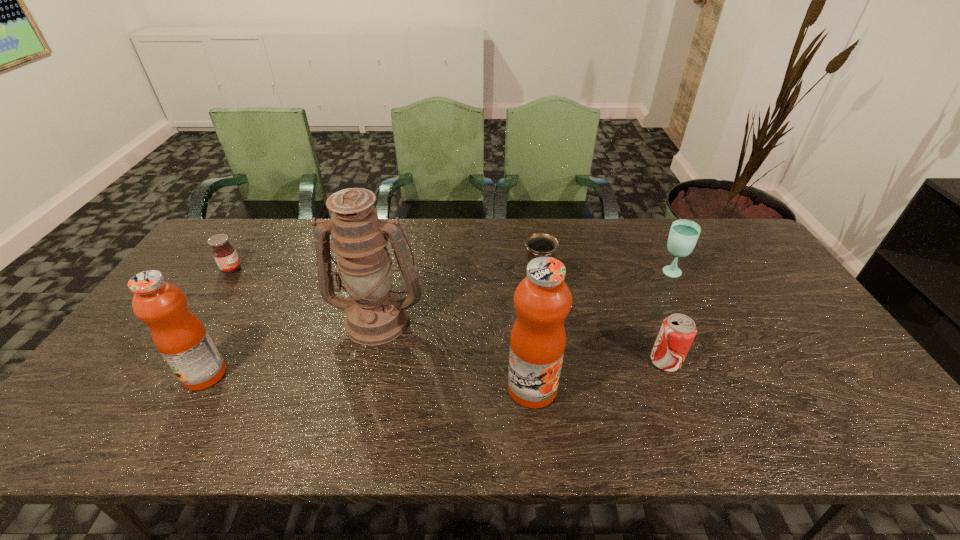
Find the location of a particular element. Image resolution: width=960 pixels, height=540 pixels. the fifth shortest object is located at coordinates (180, 337).

Where is `the second object from left to right`? the second object from left to right is located at coordinates (180, 337).

The width and height of the screenshot is (960, 540). I want to click on the right fruit juice, so click(x=542, y=299).

Identify the location of the fifth object from right to left. (375, 315).

At what (x,y) coordinates should I click in order to perform the action: click on the rightmost object. Please return your answer as a coordinate pair (x, y). The width and height of the screenshot is (960, 540). Looking at the image, I should click on (683, 236).

The height and width of the screenshot is (540, 960). I want to click on soda can, so click(x=677, y=332).

Find the location of `the sixth tallest object`. the sixth tallest object is located at coordinates (677, 332).

What are the coordinates of `the leftmost object` in the screenshot? It's located at (225, 255).

Find the location of a particular element. This screenshot has width=960, height=540. jam is located at coordinates (225, 255).

Identify the location of chalice. (538, 244).